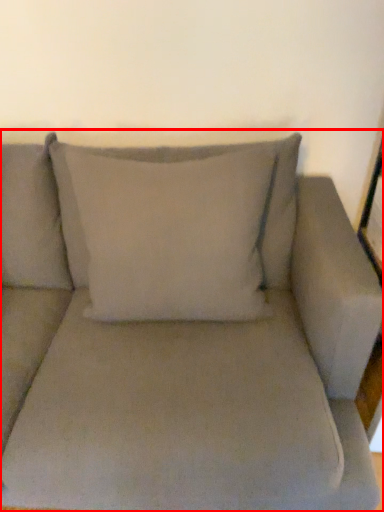
Question: In this image, where is studio couch (annotated by the red box) located relative to pillow?

Choices:
 (A) right
 (B) left

Answer: (B)